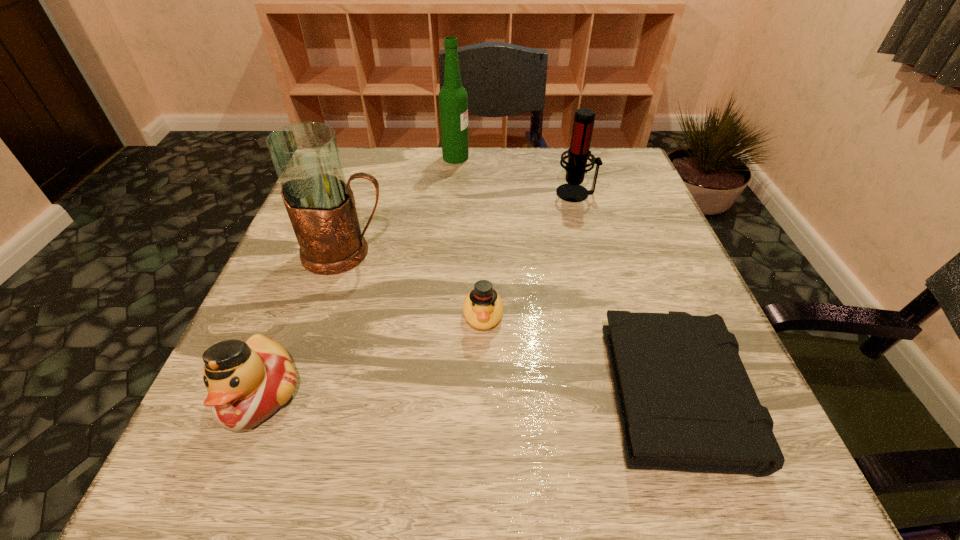
Locate an element on the screen. This screenshot has width=960, height=540. duck that is at the left edge is located at coordinates (247, 382).

Find the location of a particular element. microphone present at the right edge is located at coordinates (578, 153).

Identify the location of Bible located in the right edge section of the desktop. The height and width of the screenshot is (540, 960). (685, 401).

Find the location of a particular element. This screenshot has height=540, width=960. object situated at the far right corner is located at coordinates (578, 153).

The image size is (960, 540). I want to click on object that is at the near right corner, so click(x=685, y=401).

Where is `vacant space at the far edge of the desktop`? This screenshot has height=540, width=960. vacant space at the far edge of the desktop is located at coordinates (429, 164).

The height and width of the screenshot is (540, 960). Find the location of `blank area at the near edge`. blank area at the near edge is located at coordinates (318, 477).

The width and height of the screenshot is (960, 540). What are the coordinates of `free space at the right edge` in the screenshot? It's located at (694, 296).

Find the location of a particular element. This screenshot has height=540, width=960. vacant space at the far left corner of the desktop is located at coordinates (369, 152).

Identify the location of vacant space at the near left corner of the desktop. (185, 470).